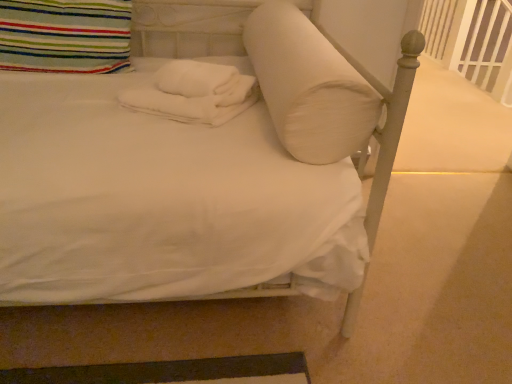
Describe the element at coordinates (472, 41) in the screenshot. This screenshot has width=512, height=384. I see `white plastic balustrade at upper right` at that location.

Where is `white soft pillow at center, which is counted as the first pillow, starting from the right`? white soft pillow at center, which is counted as the first pillow, starting from the right is located at coordinates (309, 86).

This screenshot has width=512, height=384. I want to click on striped fabric pillow at upper left, the 2th pillow positioned from the right, so pos(65,36).

Considering the relative sizes of white soft pillow at center, the second pillow when ordered from left to right, and white soft towels at center in the image provided, is white soft pillow at center, the second pillow when ordered from left to right, taller than white soft towels at center?

Correct, white soft pillow at center, the second pillow when ordered from left to right, is much taller as white soft towels at center.

Image resolution: width=512 pixels, height=384 pixels. I want to click on material on the left of the white soft pillow at center, the second pillow when ordered from left to right, so coord(195,93).

Looking at this image, considering the relative positions of white soft pillow at center, the second pillow when ordered from left to right, and white soft towels at center in the image provided, is white soft pillow at center, the second pillow when ordered from left to right, behind white soft towels at center?

No, it is not.

How different are the orientations of white soft pillow at center, which is counted as the first pillow, starting from the right, and white soft towels at center in degrees?

5.29e-05 degrees separate the facing orientations of white soft pillow at center, which is counted as the first pillow, starting from the right, and white soft towels at center.

Between white soft towels at center and striped fabric pillow at upper left, the 2th pillow positioned from the right, which one has larger size?

Bigger between the two is striped fabric pillow at upper left, the 2th pillow positioned from the right.

Does white soft towels at center have a greater height compared to striped fabric pillow at upper left, the 2th pillow positioned from the right?

Incorrect, the height of white soft towels at center is not larger of that of striped fabric pillow at upper left, the 2th pillow positioned from the right.

Which is in front, white soft towels at center or striped fabric pillow at upper left, the 2th pillow positioned from the right?

Positioned in front is white soft towels at center.

From a real-world perspective, is white plastic balustrade at upper right below striped fabric pillow at upper left, the first pillow in the left-to-right sequence?

Indeed, from a real-world perspective, white plastic balustrade at upper right is positioned beneath striped fabric pillow at upper left, the first pillow in the left-to-right sequence.

Can you confirm if white plastic balustrade at upper right is shorter than striped fabric pillow at upper left, the first pillow in the left-to-right sequence?

In fact, white plastic balustrade at upper right may be taller than striped fabric pillow at upper left, the first pillow in the left-to-right sequence.

Can you confirm if white plastic balustrade at upper right is smaller than striped fabric pillow at upper left, the first pillow in the left-to-right sequence?

Incorrect, white plastic balustrade at upper right is not smaller in size than striped fabric pillow at upper left, the first pillow in the left-to-right sequence.

Does white plastic balustrade at upper right have a greater width compared to striped fabric pillow at upper left, the 2th pillow positioned from the right?

No.

From the image's perspective, which is below, striped fabric pillow at upper left, the first pillow in the left-to-right sequence, or white soft pillow at center, the second pillow when ordered from left to right?

white soft pillow at center, the second pillow when ordered from left to right.

Between striped fabric pillow at upper left, the 2th pillow positioned from the right, and white soft pillow at center, the second pillow when ordered from left to right, which one is positioned in front?

white soft pillow at center, the second pillow when ordered from left to right, is closer to the camera.

Considering the sizes of objects striped fabric pillow at upper left, the first pillow in the left-to-right sequence, and white soft pillow at center, which is counted as the first pillow, starting from the right, in the image provided, who is thinner, striped fabric pillow at upper left, the first pillow in the left-to-right sequence, or white soft pillow at center, which is counted as the first pillow, starting from the right,?

With smaller width is striped fabric pillow at upper left, the first pillow in the left-to-right sequence.

Considering the sizes of striped fabric pillow at upper left, the first pillow in the left-to-right sequence, and white soft towels at center in the image, is striped fabric pillow at upper left, the first pillow in the left-to-right sequence, taller or shorter than white soft towels at center?

striped fabric pillow at upper left, the first pillow in the left-to-right sequence, is taller than white soft towels at center.

From a real-world perspective, who is located lower, striped fabric pillow at upper left, the 2th pillow positioned from the right, or white soft towels at center?

In real-world perspective, white soft towels at center is lower.

Looking at their sizes, would you say striped fabric pillow at upper left, the first pillow in the left-to-right sequence, is wider or thinner than white soft towels at center?

striped fabric pillow at upper left, the first pillow in the left-to-right sequence, is thinner than white soft towels at center.

Which is less distant, (x=46, y=20) or (x=227, y=76)?

The point (x=227, y=76) is in front.

What's the angular difference between white soft pillow at center, which is counted as the first pillow, starting from the right, and white plastic balustrade at upper right's facing directions?

The angular difference between white soft pillow at center, which is counted as the first pillow, starting from the right, and white plastic balustrade at upper right is 5.66 degrees.

Is white soft pillow at center, the second pillow when ordered from left to right, facing away from white plastic balustrade at upper right?

white soft pillow at center, the second pillow when ordered from left to right, is not turned away from white plastic balustrade at upper right.

Consider the image. Is white soft pillow at center, which is counted as the first pillow, starting from the right, shorter than white plastic balustrade at upper right?

Correct, white soft pillow at center, which is counted as the first pillow, starting from the right, is not as tall as white plastic balustrade at upper right.

Which pillow is the 2nd one when counting from the front of the white plastic balustrade at upper right? Please provide its 2D coordinates.

[(309, 86)]

Is white soft towels at center positioned beyond the bounds of white soft pillow at center, the second pillow when ordered from left to right?

Yes.

Consider the image. Is white soft towels at center oriented towards white soft pillow at center, the second pillow when ordered from left to right?

No, white soft towels at center is not facing towards white soft pillow at center, the second pillow when ordered from left to right.

From the image's perspective, which object appears higher, white soft towels at center or white soft pillow at center, the second pillow when ordered from left to right?

white soft pillow at center, the second pillow when ordered from left to right, is shown above in the image.

Between white soft towels at center and white soft pillow at center, which is counted as the first pillow, starting from the right, which one has larger size?

white soft pillow at center, which is counted as the first pillow, starting from the right, is bigger.

Find the location of `material that appears behind the white soft pillow at center, the second pillow when ordered from left to right`. material that appears behind the white soft pillow at center, the second pillow when ordered from left to right is located at coordinates (195, 93).

This screenshot has height=384, width=512. Identify the location of material below the striped fabric pillow at upper left, the 2th pillow positioned from the right (from a real-world perspective). (195, 93).

Which object lies nearer to the anchor point white plastic balustrade at upper right, striped fabric pillow at upper left, the 2th pillow positioned from the right, or white soft pillow at center, the second pillow when ordered from left to right?

white soft pillow at center, the second pillow when ordered from left to right.

Estimate the real-world distances between objects in this image. Which object is further from white plastic balustrade at upper right, white soft towels at center or striped fabric pillow at upper left, the first pillow in the left-to-right sequence?

striped fabric pillow at upper left, the first pillow in the left-to-right sequence, lies further to white plastic balustrade at upper right than the other object.

Based on their spatial positions, is white plastic balustrade at upper right or striped fabric pillow at upper left, the first pillow in the left-to-right sequence, further from white soft towels at center?

Based on the image, white plastic balustrade at upper right appears to be further to white soft towels at center.

When comparing their distances from white soft towels at center, does striped fabric pillow at upper left, the 2th pillow positioned from the right, or white plastic balustrade at upper right seem closer?

Among the two, striped fabric pillow at upper left, the 2th pillow positioned from the right, is located nearer to white soft towels at center.

Based on their spatial positions, is white soft pillow at center, which is counted as the first pillow, starting from the right, or striped fabric pillow at upper left, the first pillow in the left-to-right sequence, closer to white plastic balustrade at upper right?

white soft pillow at center, which is counted as the first pillow, starting from the right, lies closer to white plastic balustrade at upper right than the other object.

From the image, which object appears to be farther from white soft towels at center, white soft pillow at center, the second pillow when ordered from left to right, or white plastic balustrade at upper right?

white plastic balustrade at upper right.

When comparing their distances from white soft pillow at center, which is counted as the first pillow, starting from the right, does striped fabric pillow at upper left, the 2th pillow positioned from the right, or white plastic balustrade at upper right seem closer?

striped fabric pillow at upper left, the 2th pillow positioned from the right.

From the picture: Which object lies further to the anchor point white soft pillow at center, the second pillow when ordered from left to right, white soft towels at center or striped fabric pillow at upper left, the 2th pillow positioned from the right?

The object further to white soft pillow at center, the second pillow when ordered from left to right, is striped fabric pillow at upper left, the 2th pillow positioned from the right.

You are a GUI agent. You are given a task and a screenshot of the screen. Output one action in this format:
    pyautogui.click(x=<x>, y=<y>)
    Task: Click on the material between striped fabric pillow at upper left, the 2th pillow positioned from the right, and white plastic balustrade at upper right, in the horizontal direction
    
    Given the screenshot: What is the action you would take?
    pyautogui.click(x=195, y=93)

You are a GUI agent. You are given a task and a screenshot of the screen. Output one action in this format:
    pyautogui.click(x=<x>, y=<y>)
    Task: Click on the material positioned between white soft pillow at center, the second pillow when ordered from left to right, and white plastic balustrade at upper right from near to far
    
    Given the screenshot: What is the action you would take?
    pyautogui.click(x=195, y=93)

Locate an element on the screen. This screenshot has height=384, width=512. pillow positioned between white soft pillow at center, which is counted as the first pillow, starting from the right, and white plastic balustrade at upper right from near to far is located at coordinates (65, 36).

At what (x,y) coordinates should I click in order to perform the action: click on material situated between striped fabric pillow at upper left, the 2th pillow positioned from the right, and white soft pillow at center, the second pillow when ordered from left to right, from left to right. Please return your answer as a coordinate pair (x, y). The width and height of the screenshot is (512, 384). Looking at the image, I should click on (195, 93).